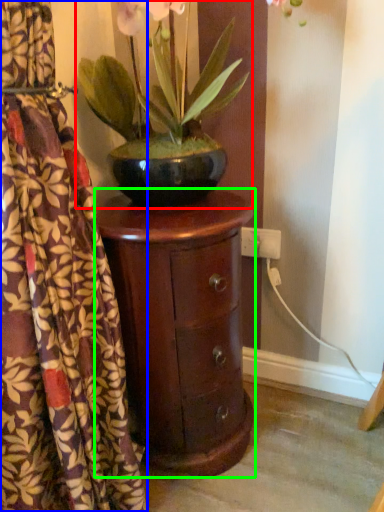
Question: Which is nearer to the houseplant (highlighted by a red box)? curtain (highlighted by a blue box) or nightstand (highlighted by a green box).

Choices:
 (A) curtain
 (B) nightstand

Answer: (B)